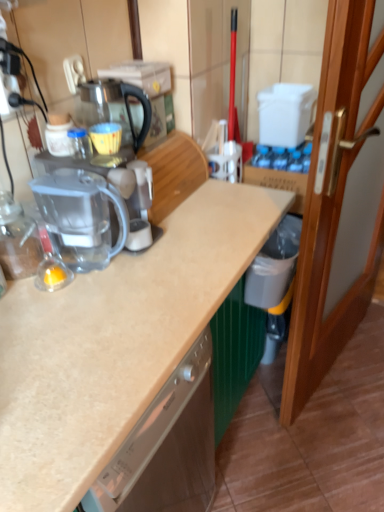
Locate an element on the screen. This screenshot has height=512, width=384. vacant space to the right of transparent plastic coffee machine at center is located at coordinates (191, 230).